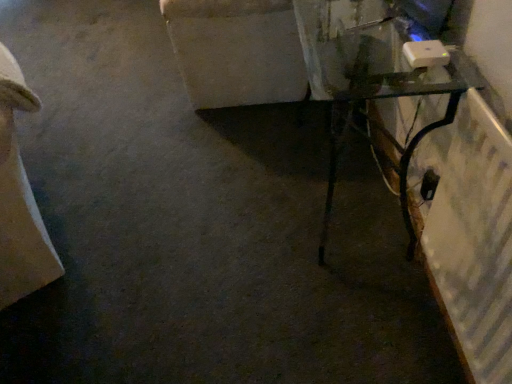
Image resolution: width=512 pixels, height=384 pixels. What are the coordinates of `blue glossy monitor at upper right` in the screenshot? It's located at (426, 13).

Where is `beige fabric couch at left`? The width and height of the screenshot is (512, 384). beige fabric couch at left is located at coordinates (20, 199).

The height and width of the screenshot is (384, 512). I want to click on transparent glass table at right, so click(376, 66).

Find the location of a particular element. The width and height of the screenshot is (512, 384). blue glossy monitor at upper right is located at coordinates (426, 13).

Is beige fabric couch at left wider than transparent glass table at right?

Indeed, beige fabric couch at left has a greater width compared to transparent glass table at right.

Choose the correct answer: Is beige fabric couch at left inside transparent glass table at right or outside it?

beige fabric couch at left exists outside the volume of transparent glass table at right.

Looking at this image, is beige fabric couch at left smaller than transparent glass table at right?

Actually, beige fabric couch at left might be larger than transparent glass table at right.

Which is nearer, [0,214] or [408,251]?

Point [0,214] is positioned closer to the camera compared to point [408,251].

From the picture: In terms of size, does blue glossy monitor at upper right appear bigger or smaller than transparent glass table at right?

In the image, blue glossy monitor at upper right appears to be smaller than transparent glass table at right.

From a real-world perspective, does blue glossy monitor at upper right stand above transparent glass table at right?

Yes.

Is point (436, 20) in front of point (382, 84)?

No, it is behind (382, 84).

Based on their positions, is transparent glass table at right located to the left or right of beige fabric couch at left?

From the image, it's evident that transparent glass table at right is to the right of beige fabric couch at left.

In the image, there is a beige fabric couch at left. Identify the location of table above it (from the image's perspective). The width and height of the screenshot is (512, 384). (376, 66).

Is point (371, 93) positioned behind point (5, 253)?

No.

Is blue glossy monitor at upper right to the right of beige fabric couch at left from the viewer's perspective?

Yes.

Is blue glossy monitor at upper right facing away from beige fabric couch at left?

No, blue glossy monitor at upper right is not facing away from beige fabric couch at left.

Is blue glossy monitor at upper right wider or thinner than beige fabric couch at left?

In the image, blue glossy monitor at upper right appears to be more narrow than beige fabric couch at left.

Is blue glossy monitor at upper right positioned far away from beige fabric couch at left?

That's right, there is a large distance between blue glossy monitor at upper right and beige fabric couch at left.

From a real-world perspective, between transparent glass table at right and blue glossy monitor at upper right, who is vertically higher?

From a 3D spatial view, blue glossy monitor at upper right is above.

Considering the points (362, 26) and (423, 20), which point is in front, point (362, 26) or point (423, 20)?

The point (423, 20) is closer to the camera.

Which object is further away from the camera taking this photo, transparent glass table at right or blue glossy monitor at upper right?

blue glossy monitor at upper right is further from the camera.

Does beige fabric couch at left have a lesser height compared to blue glossy monitor at upper right?

In fact, beige fabric couch at left may be taller than blue glossy monitor at upper right.

From the image's perspective, which one is positioned higher, beige fabric couch at left or blue glossy monitor at upper right?

blue glossy monitor at upper right, from the image's perspective.

In the scene shown: Can you confirm if beige fabric couch at left is thinner than blue glossy monitor at upper right?

Incorrect, the width of beige fabric couch at left is not less than that of blue glossy monitor at upper right.

Find the location of a particular element. The image size is (512, 384). furniture in front of the transparent glass table at right is located at coordinates (20, 199).

I want to click on table that is below the blue glossy monitor at upper right (from the image's perspective), so click(x=376, y=66).

Which object lies nearer to the anchor point beige fabric couch at left, blue glossy monitor at upper right or transparent glass table at right?

The object closer to beige fabric couch at left is transparent glass table at right.

When comparing their distances from transparent glass table at right, does blue glossy monitor at upper right or beige fabric couch at left seem closer?

blue glossy monitor at upper right is positioned closer to the anchor transparent glass table at right.

Based on their spatial positions, is beige fabric couch at left or transparent glass table at right further from blue glossy monitor at upper right?

beige fabric couch at left.

Looking at the image, which one is located closer to beige fabric couch at left, transparent glass table at right or blue glossy monitor at upper right?

transparent glass table at right is positioned closer to the anchor beige fabric couch at left.

Based on their spatial positions, is transparent glass table at right or beige fabric couch at left further from blue glossy monitor at upper right?

Among the two, beige fabric couch at left is located further to blue glossy monitor at upper right.

Considering their positions, is beige fabric couch at left positioned further to transparent glass table at right than blue glossy monitor at upper right?

beige fabric couch at left is positioned further to the anchor transparent glass table at right.

Where is `table situated between beige fabric couch at left and blue glossy monitor at upper right from left to right`? table situated between beige fabric couch at left and blue glossy monitor at upper right from left to right is located at coordinates (376, 66).